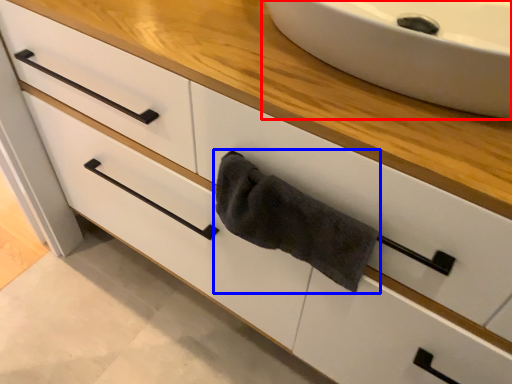
Question: Which object is closer to the camera taking this photo, sink (highlighted by a red box) or bath towel (highlighted by a blue box)?

Choices:
 (A) sink
 (B) bath towel

Answer: (A)